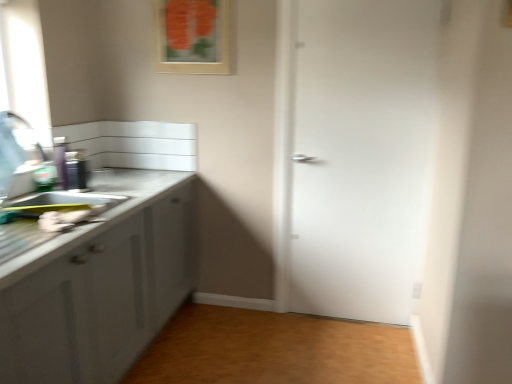
Find the location of a particular element. The width and height of the screenshot is (512, 384). vacant space to the left of white matte door at center is located at coordinates click(x=281, y=333).